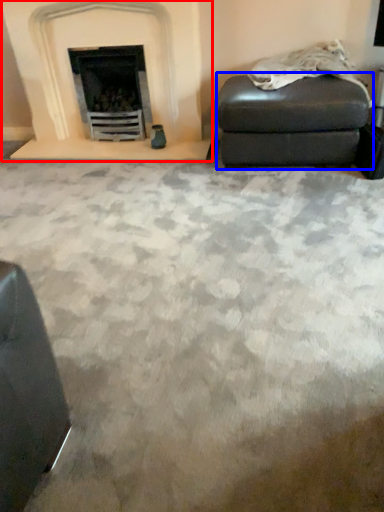
Question: Among these objects, which one is farthest to the camera, fireplace (highlighted by a red box) or stool (highlighted by a blue box)?

Choices:
 (A) fireplace
 (B) stool

Answer: (A)